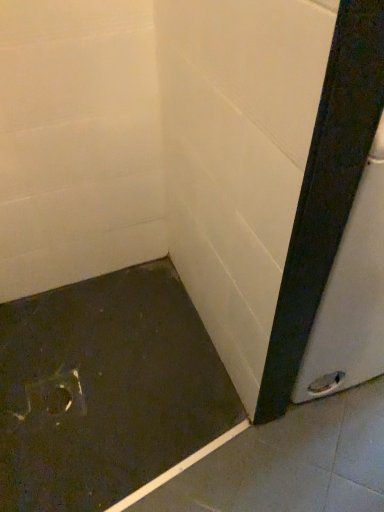
The height and width of the screenshot is (512, 384). What are the coordinates of `metallic hole at lower left` in the screenshot? It's located at (55, 395).

Describe the element at coordinates (55, 395) in the screenshot. This screenshot has height=512, width=384. I see `metallic hole at lower left` at that location.

You are a GUI agent. You are given a task and a screenshot of the screen. Output one action in this format:
    pyautogui.click(x=<x>, y=<y>)
    Task: Click on the metallic hole at lower left
    
    Given the screenshot: What is the action you would take?
    pyautogui.click(x=55, y=395)